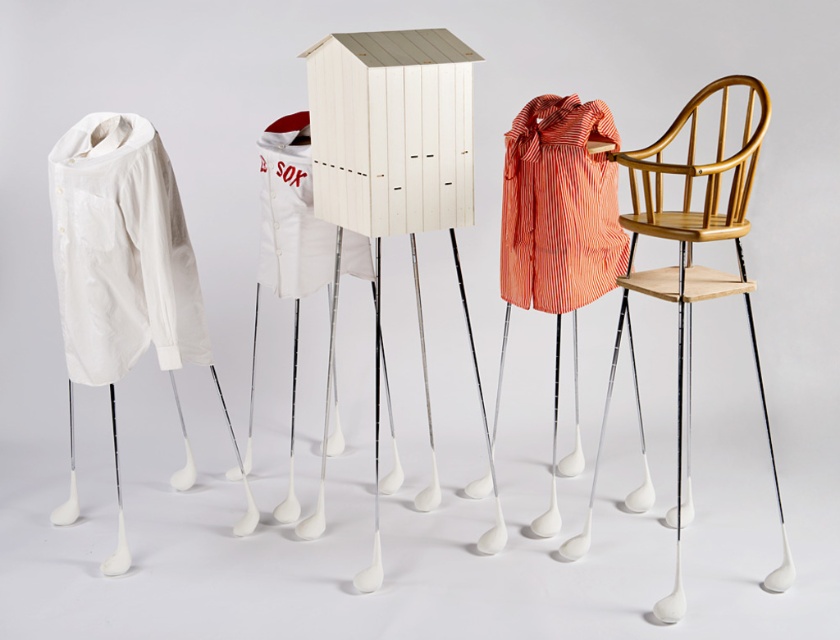
Question: Among these points, which one is farthest from the camera?

Choices:
 (A) (114, 259)
 (B) (651, 168)
 (C) (369, 269)
 (D) (558, 177)

Answer: (C)

Question: Where is striped cotton shirt at right located in relation to white glossy golf club legs at center in the image?

Choices:
 (A) right
 (B) left

Answer: (A)

Question: Which of these objects is positioned closest to the wooden high chair at right?

Choices:
 (A) striped cotton shirt at right
 (B) white fabric shirt at left

Answer: (A)

Question: Is white smooth shirt at left thinner than wooden chair at center?

Choices:
 (A) yes
 (B) no

Answer: (A)

Question: Among these points, which one is nearest to the camera?

Choices:
 (A) (274, 252)
 (B) (63, 225)
 (C) (292, 220)
 (D) (96, 305)

Answer: (B)

Question: Can you confirm if wooden high chair at right is positioned to the right of white cotton baseball jersey at center?

Choices:
 (A) yes
 (B) no

Answer: (A)